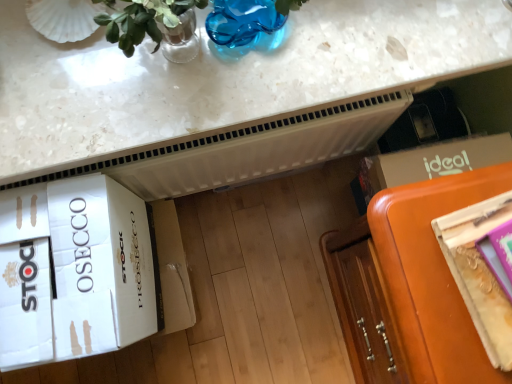
Question: Does metallic gold magazine at right touch orange leather couch at lower right?

Choices:
 (A) no
 (B) yes

Answer: (A)

Question: Does metallic gold magazine at right have a larger size compared to orange leather couch at lower right?

Choices:
 (A) no
 (B) yes

Answer: (A)

Question: Is orange leather couch at lower right surrounded by metallic gold magazine at right?

Choices:
 (A) no
 (B) yes

Answer: (A)

Question: Is metallic gold magazine at right positioned with its back to orange leather couch at lower right?

Choices:
 (A) yes
 (B) no

Answer: (B)

Question: Considering the relative positions of metallic gold magazine at right and orange leather couch at lower right in the image provided, is metallic gold magazine at right to the left of orange leather couch at lower right from the viewer's perspective?

Choices:
 (A) no
 (B) yes

Answer: (A)

Question: Considering the positions of metallic gold magazine at right and white cardboard box at lower left in the image, is metallic gold magazine at right wider or thinner than white cardboard box at lower left?

Choices:
 (A) wide
 (B) thin

Answer: (B)

Question: Do you think metallic gold magazine at right is within white cardboard box at lower left, or outside of it?

Choices:
 (A) inside
 (B) outside

Answer: (B)

Question: From the image's perspective, is metallic gold magazine at right located above or below white cardboard box at lower left?

Choices:
 (A) below
 (B) above

Answer: (B)

Question: In terms of size, does metallic gold magazine at right appear bigger or smaller than white cardboard box at lower left?

Choices:
 (A) small
 (B) big

Answer: (A)

Question: Is point (276, 31) positioned closer to the camera than point (144, 311)?

Choices:
 (A) farther
 (B) closer

Answer: (B)

Question: Is blue glass vase at upper center bigger or smaller than white cardboard box at lower left?

Choices:
 (A) big
 (B) small

Answer: (B)

Question: From a real-world perspective, is blue glass vase at upper center above or below white cardboard box at lower left?

Choices:
 (A) below
 (B) above

Answer: (B)

Question: From the image's perspective, is blue glass vase at upper center positioned above or below white cardboard box at lower left?

Choices:
 (A) above
 (B) below

Answer: (A)

Question: From the image's perspective, is blue glass vase at upper center positioned above or below metallic gold magazine at right?

Choices:
 (A) below
 (B) above

Answer: (B)

Question: Based on their sizes in the image, would you say blue glass vase at upper center is bigger or smaller than metallic gold magazine at right?

Choices:
 (A) big
 (B) small

Answer: (B)